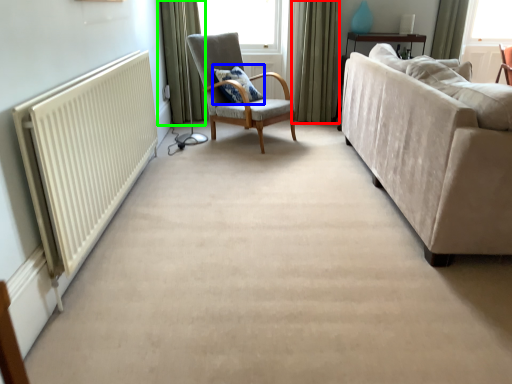
Question: Which object is the farthest from curtain (highlighted by a red box)? Choose among these: pillow (highlighted by a blue box) or curtain (highlighted by a green box).

Choices:
 (A) pillow
 (B) curtain

Answer: (B)